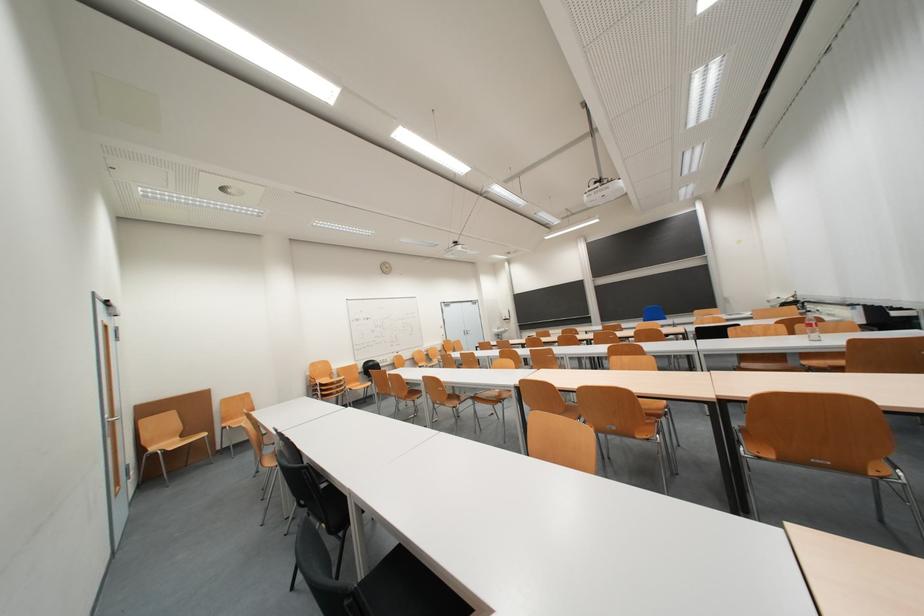
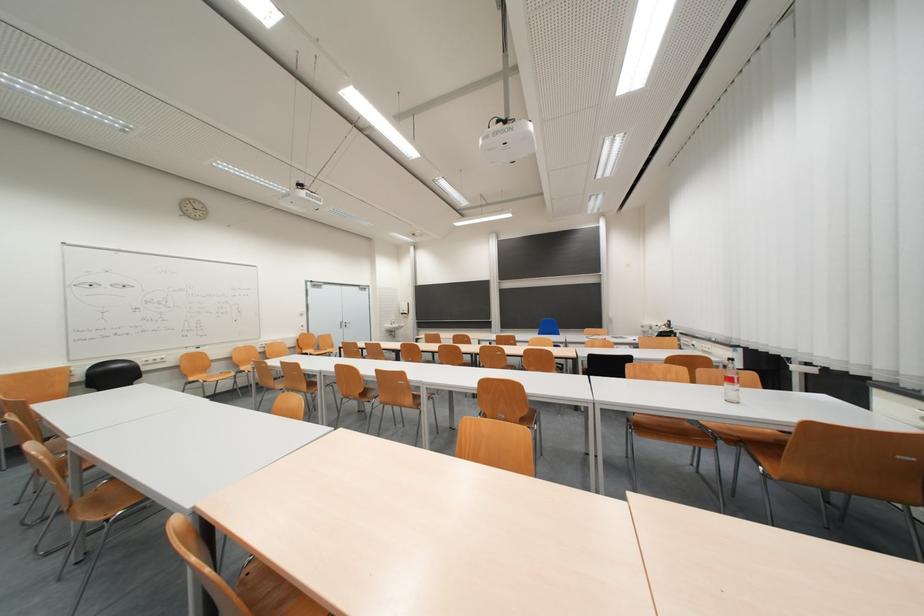
In a continuous first-person perspective shot, in which direction is the camera moving?

The movement direction of the cameraman is right, forward.